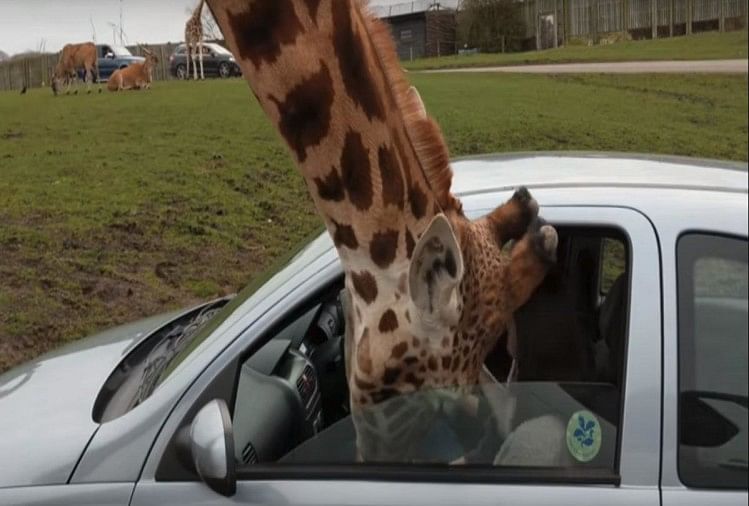
This screenshot has height=506, width=749. Identify the location of mirror. (216, 451).